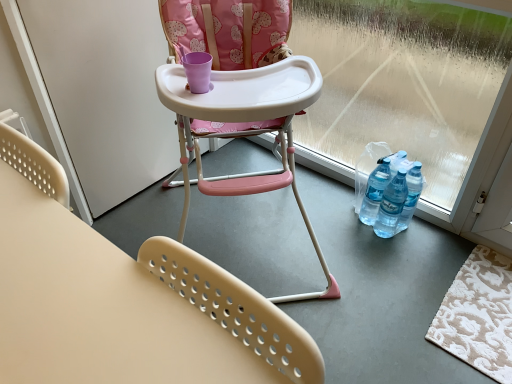
Identify the location of free space between white matte screen door at left and beige textured rug at lower right. Image resolution: width=512 pixels, height=384 pixels. (296, 247).